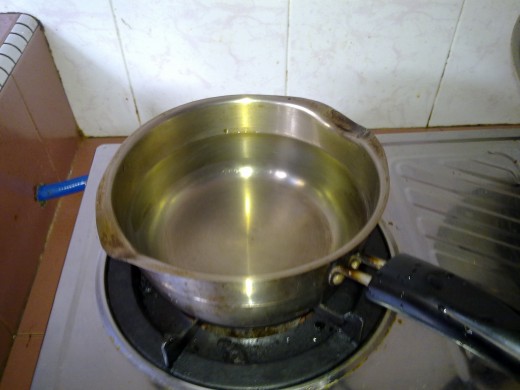
At what (x,y) coordinates should I click in order to perform the action: click on handle screws. Please return your answer as a coordinate pair (x, y). This screenshot has width=520, height=390. Looking at the image, I should click on (337, 277), (353, 265).